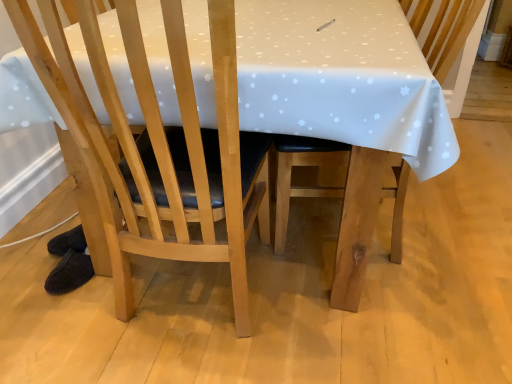
Image resolution: width=512 pixels, height=384 pixels. I want to click on free spot to the right of wooden chair at center, the first chair when ordered from right to left, so click(x=465, y=220).